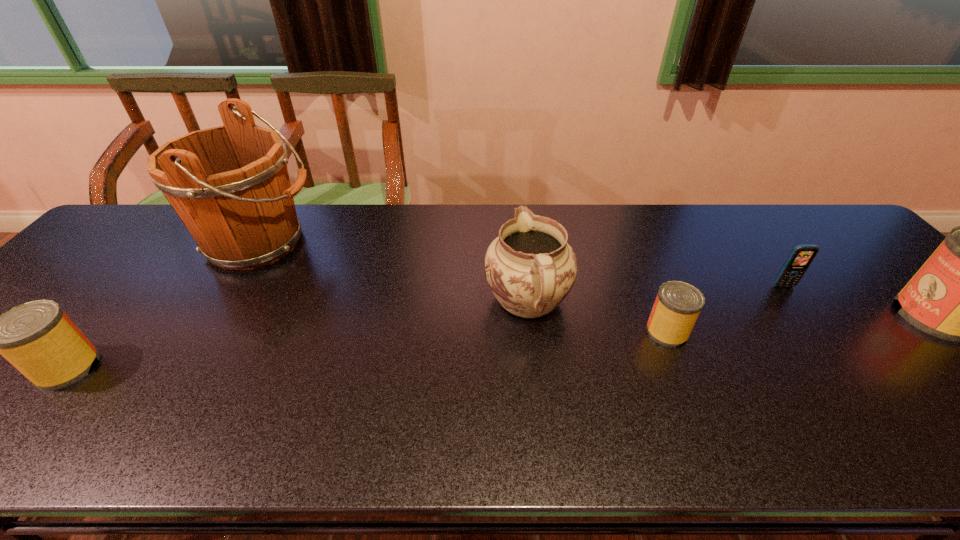
The image size is (960, 540). What are the coordinates of `vacant area at the left edge of the desktop` in the screenshot? It's located at (139, 261).

In the image, there is a desktop. Where is `free region at the far right corner`? The height and width of the screenshot is (540, 960). free region at the far right corner is located at coordinates (787, 219).

This screenshot has height=540, width=960. I want to click on unoccupied position between the second shortest can and the third object from right to left, so click(x=368, y=349).

I want to click on vacant area between the second shortest can and the cellular telephone, so (x=425, y=327).

Find the location of a particular element. The width and height of the screenshot is (960, 540). free space between the fourth object from right to left and the tallest object is located at coordinates (394, 272).

This screenshot has height=540, width=960. Identify the location of free space between the third object from left to right and the leftmost object. (298, 335).

Image resolution: width=960 pixels, height=540 pixels. Find the location of `vacant area that lies between the leftmost object and the cellular telephone`. vacant area that lies between the leftmost object and the cellular telephone is located at coordinates (425, 327).

At what (x,y) coordinates should I click in order to perform the action: click on vacant area between the second can from left to right and the cellular telephone. Please return your answer as a coordinate pair (x, y). The width and height of the screenshot is (960, 540). Looking at the image, I should click on (726, 309).

I want to click on free space between the leftmost object and the cellular telephone, so click(x=425, y=327).

You are a GUI agent. You are given a task and a screenshot of the screen. Output one action in this format:
    pyautogui.click(x=<x>, y=<y>)
    Task: Click on the vacant area that lies between the second can from left to right and the leftmost can
    
    Given the screenshot: What is the action you would take?
    pyautogui.click(x=368, y=349)